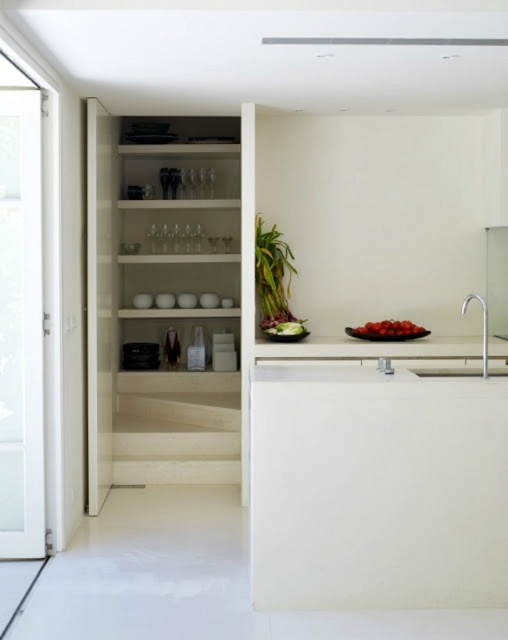
Consider the image. You are preparing to wash the white glossy bowls at center in the kitchen. The sink is located under the satin nickel faucet at right. Can you reach the faucet to turn it on while holding the bowls?

The white glossy bowls at center are to the left of the satin nickel faucet at right, so you can reach the faucet to turn it on while holding the bowls.

You are a chef preparing a dish and need to place a cutting board between the white glossy bowls at center and the satin nickel faucet at right. Considering their heights, which object should the cutting board be placed closer to in order to maintain stability?

The white glossy bowls at center has a lesser height compared to the satin nickel faucet at right, so the cutting board should be placed closer to the satin nickel faucet at right to maintain stability.

You are standing in the kitchen and want to place a small vase on the closest surface. Which surface should you choose between the white glass door at left and the white glossy countertop at center?

The white glass door at left is closer to the viewer than the white glossy countertop at center, so you should place the vase on the white glass door at left.